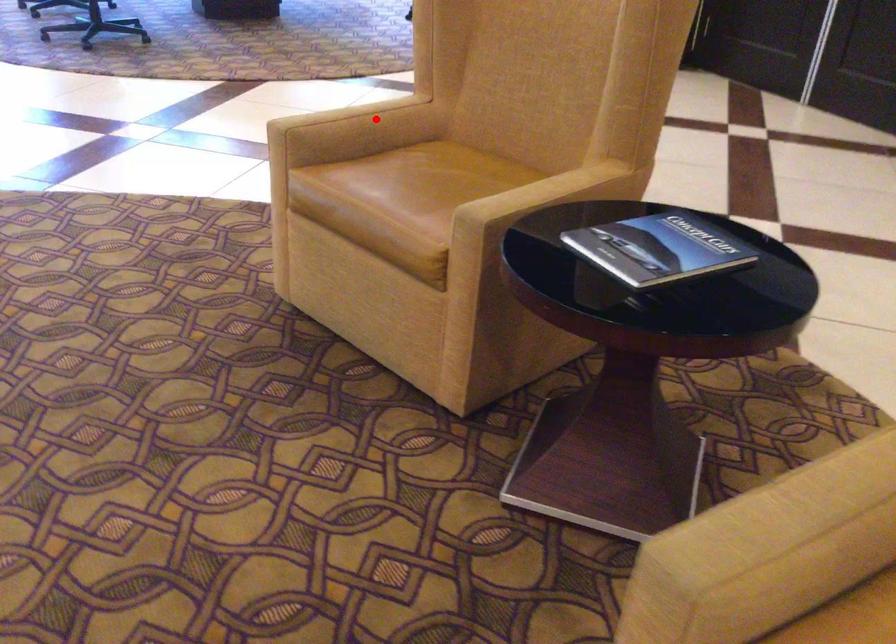
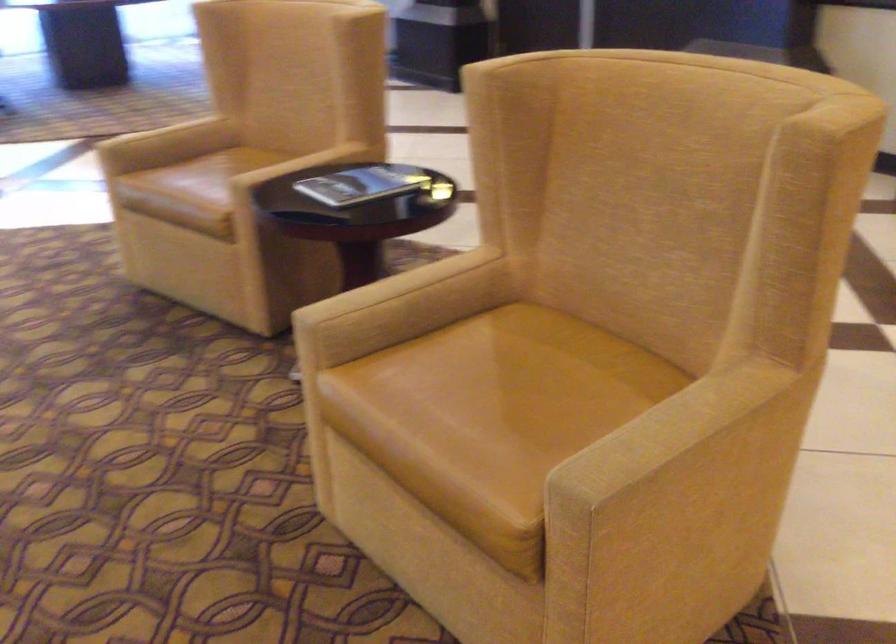
Locate, in the second image, the point that corresponds to the highlighted location in the first image.

(183, 129)